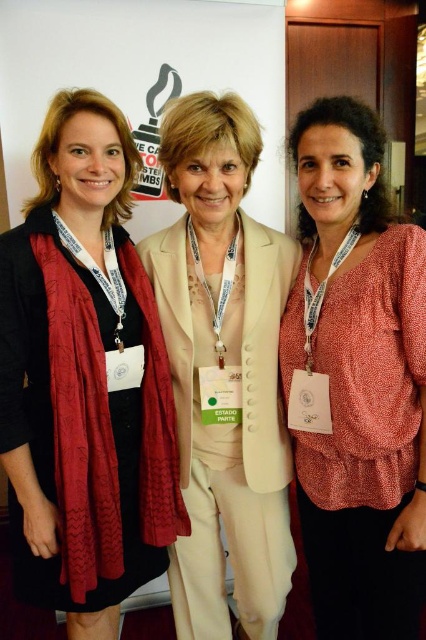
Does matte black scarf at left have a lesser width compared to matte coral blouse at right?

No.

Is matte black scarf at left closer to the viewer compared to matte coral blouse at right?

No, it is behind matte coral blouse at right.

Between point (88, 252) and point (325, 573), which one is positioned behind?

Positioned behind is point (325, 573).

At what (x,y) coordinates should I click in order to perform the action: click on matte black scarf at left. Please return your answer as a coordinate pair (x, y). Looking at the image, I should click on (85, 378).

Consider the image. Is matte coral blouse at right closer to camera compared to metallic gold medal at center?

Yes, it is.

Find the location of `matte coral blouse at right`. matte coral blouse at right is located at coordinates (356, 380).

Is point (298, 342) more distant than point (221, 344)?

No.

I want to click on matte coral blouse at right, so click(x=356, y=380).

Who is taller, matte black scarf at left or metallic gold medal at center?

matte black scarf at left is taller.

Does matte black scarf at left have a greater height compared to metallic gold medal at center?

Indeed, matte black scarf at left has a greater height compared to metallic gold medal at center.

Measure the distance between matte black scarf at left and camera.

matte black scarf at left is 1.27 meters from camera.

Locate an element on the screen. matte black scarf at left is located at coordinates (85, 378).